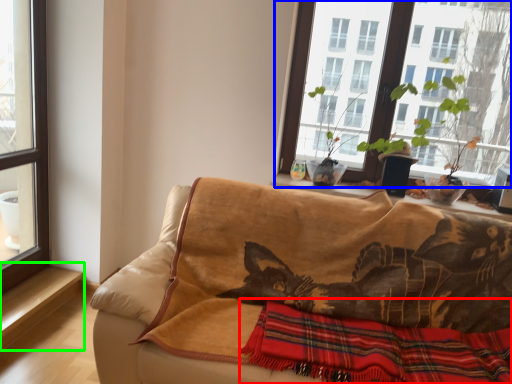
Question: Which is farther away from plaid (highlighted by a red box)? window (highlighted by a blue box) or window sill (highlighted by a green box)?

Choices:
 (A) window
 (B) window sill

Answer: (B)